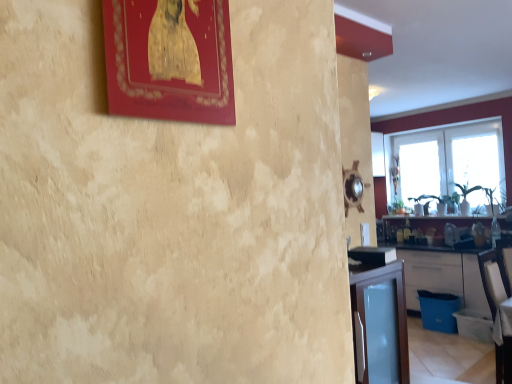
Question: Can you confirm if transparent glass window at right, acting as the 1th window starting from the front, is wider than transparent glass window at right?

Choices:
 (A) yes
 (B) no

Answer: (A)

Question: Is transparent glass window at right, positioned as the second window in back-to-front order, far away from transparent glass window at right?

Choices:
 (A) yes
 (B) no

Answer: (B)

Question: Can you confirm if transparent glass window at right, acting as the 1th window starting from the front, is bigger than transparent glass window at right?

Choices:
 (A) no
 (B) yes

Answer: (B)

Question: Is transparent glass window at right, positioned as the second window in back-to-front order, not inside transparent glass window at right?

Choices:
 (A) no
 (B) yes

Answer: (B)

Question: Does transparent glass window at right, acting as the 1th window starting from the front, have a lesser width compared to transparent glass window at right?

Choices:
 (A) yes
 (B) no

Answer: (B)

Question: Does transparent glass window at right, acting as the 1th window starting from the front, appear on the left side of transparent glass window at right?

Choices:
 (A) yes
 (B) no

Answer: (A)

Question: From the image's perspective, is matte gold picture frame at upper left below transparent glass window at right?

Choices:
 (A) no
 (B) yes

Answer: (B)

Question: Can you confirm if matte gold picture frame at upper left is thinner than transparent glass window at right?

Choices:
 (A) no
 (B) yes

Answer: (B)

Question: Is the position of matte gold picture frame at upper left more distant than that of transparent glass window at right?

Choices:
 (A) no
 (B) yes

Answer: (A)

Question: Can you confirm if matte gold picture frame at upper left is taller than transparent glass window at right?

Choices:
 (A) no
 (B) yes

Answer: (A)

Question: Could you tell me if matte gold picture frame at upper left is turned towards transparent glass window at right?

Choices:
 (A) yes
 (B) no

Answer: (B)

Question: From the image's perspective, is matte gold picture frame at upper left over transparent glass window at right?

Choices:
 (A) yes
 (B) no

Answer: (B)

Question: Considering the relative sizes of white matte cabinet at lower right and transparent glass window at upper right, the first window when ordered from back to front, in the image provided, is white matte cabinet at lower right taller than transparent glass window at upper right, the first window when ordered from back to front,?

Choices:
 (A) no
 (B) yes

Answer: (A)